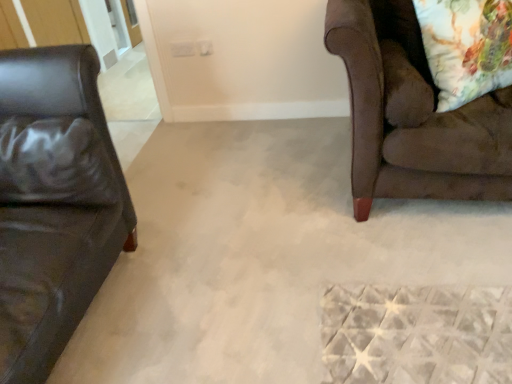
What do you see at coordinates (54, 163) in the screenshot? I see `black leather pillow at left` at bounding box center [54, 163].

What is the approximate width of floral fabric pillow at upper right?

24.96 centimeters.

At what (x,y) coordinates should I click in order to perform the action: click on black leather pillow at left. Please return your answer as a coordinate pair (x, y). Looking at the image, I should click on (54, 163).

Can you confirm if floral fabric pillow at upper right is taller than brown suede couch at right?

No.

How different are the orientations of floral fabric pillow at upper right and brown suede couch at right in degrees?

floral fabric pillow at upper right and brown suede couch at right are facing 34.5 degrees away from each other.

From the image's perspective, relative to brown suede couch at right, is floral fabric pillow at upper right above or below?

floral fabric pillow at upper right is situated higher than brown suede couch at right in the image.

Which is correct: floral fabric pillow at upper right is inside brown suede couch at right, or outside of it?

floral fabric pillow at upper right is spatially positioned inside brown suede couch at right.

Does point (359, 201) come farther from viewer compared to point (44, 202)?

Yes, point (359, 201) is behind point (44, 202).

Can you tell me how much brown suede couch at right and black leather pillow at left differ in facing direction?

The angular difference between brown suede couch at right and black leather pillow at left is 0.284 degrees.

Considering the relative sizes of brown suede couch at right and black leather pillow at left in the image provided, is brown suede couch at right shorter than black leather pillow at left?

Incorrect, the height of brown suede couch at right does not fall short of that of black leather pillow at left.

The width and height of the screenshot is (512, 384). Identify the location of studio couch directly beneath the black leather pillow at left (from a real-world perspective). (413, 114).

Which is in front, point (19, 125) or point (377, 157)?

Positioned in front is point (19, 125).

Is brown suede couch at right at the back of black leather pillow at left?

That's not correct — black leather pillow at left is not looking away from brown suede couch at right.

From the picture: Considering the positions of objects black leather pillow at left and brown suede couch at right in the image provided, who is more to the right, black leather pillow at left or brown suede couch at right?

From the viewer's perspective, brown suede couch at right appears more on the right side.

Is brown suede couch at right oriented towards floral fabric pillow at upper right?

Yes, brown suede couch at right is aimed at floral fabric pillow at upper right.

Considering the sizes of brown suede couch at right and floral fabric pillow at upper right in the image, is brown suede couch at right bigger or smaller than floral fabric pillow at upper right?

In the image, brown suede couch at right appears to be larger than floral fabric pillow at upper right.

Which object is positioned more to the left, brown suede couch at right or floral fabric pillow at upper right?

brown suede couch at right is more to the left.

How many degrees apart are the facing directions of brown suede couch at right and floral fabric pillow at upper right?

The angular difference between brown suede couch at right and floral fabric pillow at upper right is 34.5 degrees.

From a real-world perspective, which object stands above the other?

From a 3D spatial view, floral fabric pillow at upper right is above.

Which is behind, floral fabric pillow at upper right or black leather pillow at left?

floral fabric pillow at upper right is more distant.

Locate an element on the screen. throw pillow positioned vertically above the black leather pillow at left (from a real-world perspective) is located at coordinates (466, 47).

Is floral fabric pillow at upper right taller than black leather pillow at left?

Yes, floral fabric pillow at upper right is taller than black leather pillow at left.

Is floral fabric pillow at upper right completely or partially inside black leather pillow at left?

No, floral fabric pillow at upper right is not a part of black leather pillow at left.

Between black leather pillow at left and floral fabric pillow at upper right, which one is positioned behind?

Positioned behind is floral fabric pillow at upper right.

Consider the image. Which is more to the left, black leather pillow at left or floral fabric pillow at upper right?

black leather pillow at left.

How distant is black leather pillow at left from floral fabric pillow at upper right?

black leather pillow at left and floral fabric pillow at upper right are 4.61 feet apart from each other.

Where is `studio couch on the left of floral fabric pillow at upper right`? studio couch on the left of floral fabric pillow at upper right is located at coordinates (413, 114).

The width and height of the screenshot is (512, 384). Find the location of `pillow below the brown suede couch at right (from the image's perspective)`. pillow below the brown suede couch at right (from the image's perspective) is located at coordinates (54, 163).

Considering their positions, is black leather pillow at left positioned further to brown suede couch at right than floral fabric pillow at upper right?

The object further to brown suede couch at right is black leather pillow at left.

In the scene shown: Based on their spatial positions, is brown suede couch at right or floral fabric pillow at upper right further from black leather pillow at left?

The object further to black leather pillow at left is floral fabric pillow at upper right.

When comparing their distances from black leather pillow at left, does floral fabric pillow at upper right or brown suede couch at right seem further?

floral fabric pillow at upper right is positioned further to the anchor black leather pillow at left.

Considering their positions, is black leather pillow at left positioned further to floral fabric pillow at upper right than brown suede couch at right?

black leather pillow at left lies further to floral fabric pillow at upper right than the other object.

Estimate the real-world distances between objects in this image. Which object is further from floral fabric pillow at upper right, brown suede couch at right or black leather pillow at left?

black leather pillow at left is positioned further to the anchor floral fabric pillow at upper right.

When comparing their distances from brown suede couch at right, does floral fabric pillow at upper right or black leather pillow at left seem further?

Based on the image, black leather pillow at left appears to be further to brown suede couch at right.

The width and height of the screenshot is (512, 384). In order to click on studio couch between black leather pillow at left and floral fabric pillow at upper right in this screenshot , I will do `click(413, 114)`.